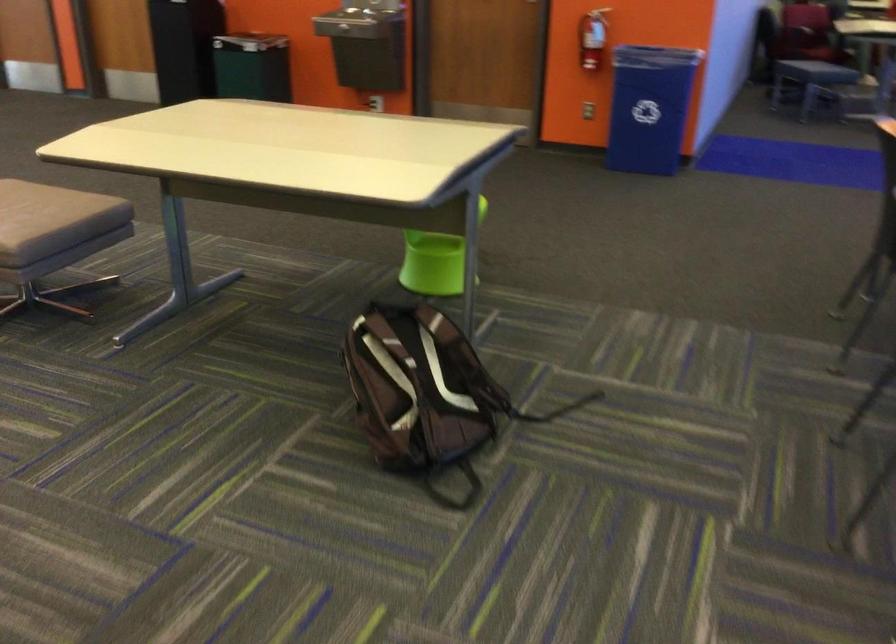
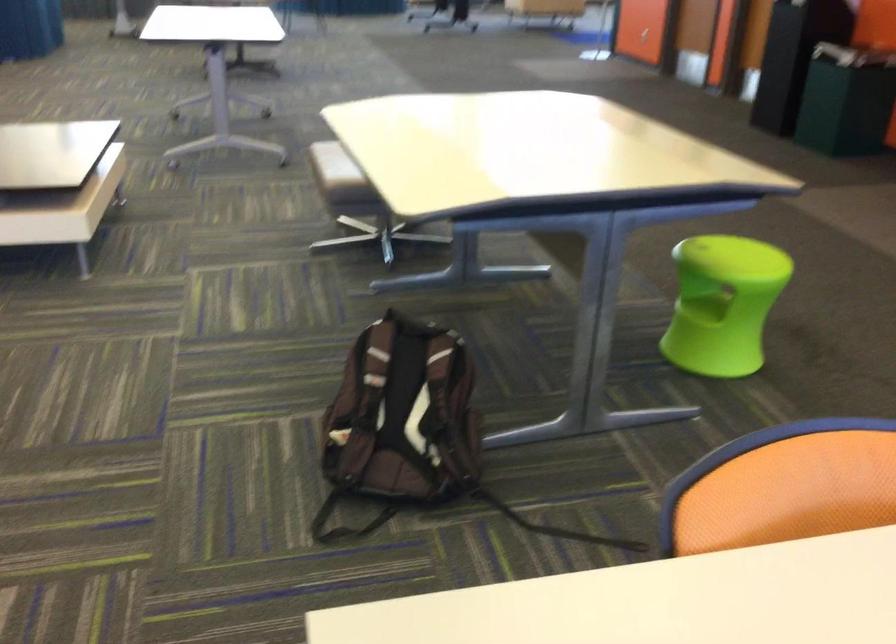
Where in the second image is the point corresponding to the point at 437,242 from the first image?

(702, 307)